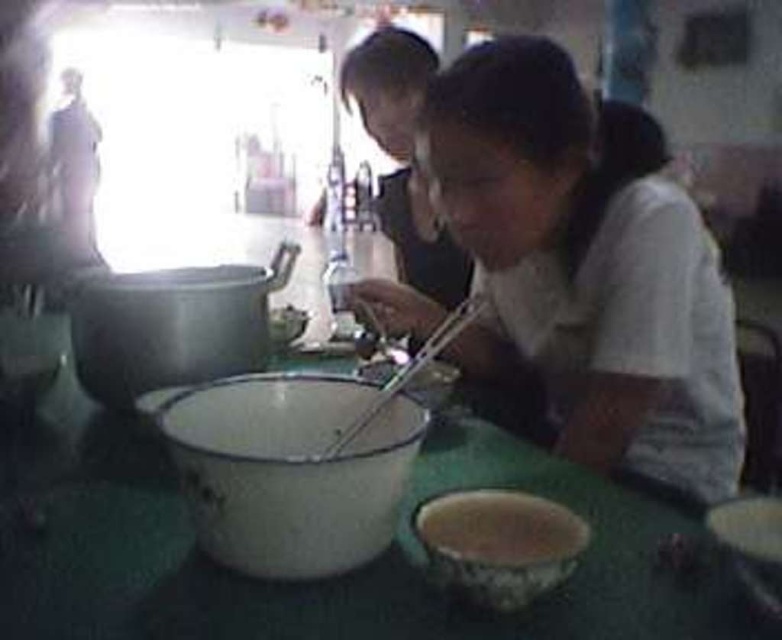
Can you confirm if white enamel mixing bowl at center is smaller than matte white mixing bowl at center?

Yes.

Who is more distant from viewer, (346, 563) or (235, 305)?

The point (235, 305) is behind.

Is point (318, 500) farther from camera compared to point (246, 314)?

No.

Where is `white enamel mixing bowl at center`? This screenshot has height=640, width=782. white enamel mixing bowl at center is located at coordinates (287, 468).

Is white enamel mixing bowl at center wider than porcelain bowl at lower center?

Correct, the width of white enamel mixing bowl at center exceeds that of porcelain bowl at lower center.

Consider the image. Is white enamel mixing bowl at center below porcelain bowl at lower center?

Actually, white enamel mixing bowl at center is above porcelain bowl at lower center.

Is point (296, 394) behind point (504, 493)?

Yes.

At what (x,y) coordinates should I click in order to perform the action: click on white enamel mixing bowl at center. Please return your answer as a coordinate pair (x, y). Looking at the image, I should click on (287, 468).

Can you confirm if matte white mixing bowl at center is positioned above porcelain bowl at lower center?

Correct, matte white mixing bowl at center is located above porcelain bowl at lower center.

Who is more forward, (242,328) or (526,556)?

Point (526,556) is more forward.

Is point (181, 314) farther from camera compared to point (454, 563)?

Yes, point (181, 314) is farther from viewer.

Find the location of `matte white mixing bowl at center`. matte white mixing bowl at center is located at coordinates (174, 324).